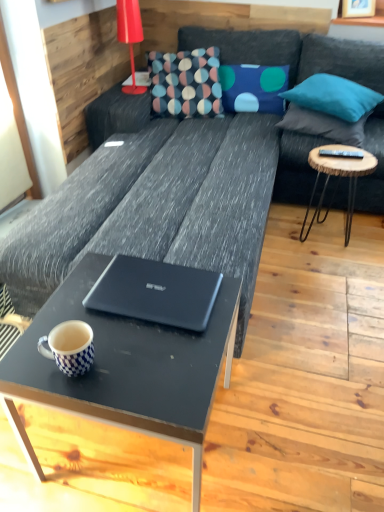
You are a GUI agent. You are given a task and a screenshot of the screen. Output one action in this format:
    pyautogui.click(x=<x>, y=<y>)
    Task: Click on the vacant space to the right of white checkered mug at lower left
    Image resolution: width=384 pixels, height=512 pixels.
    Given the screenshot: What is the action you would take?
    pyautogui.click(x=140, y=367)